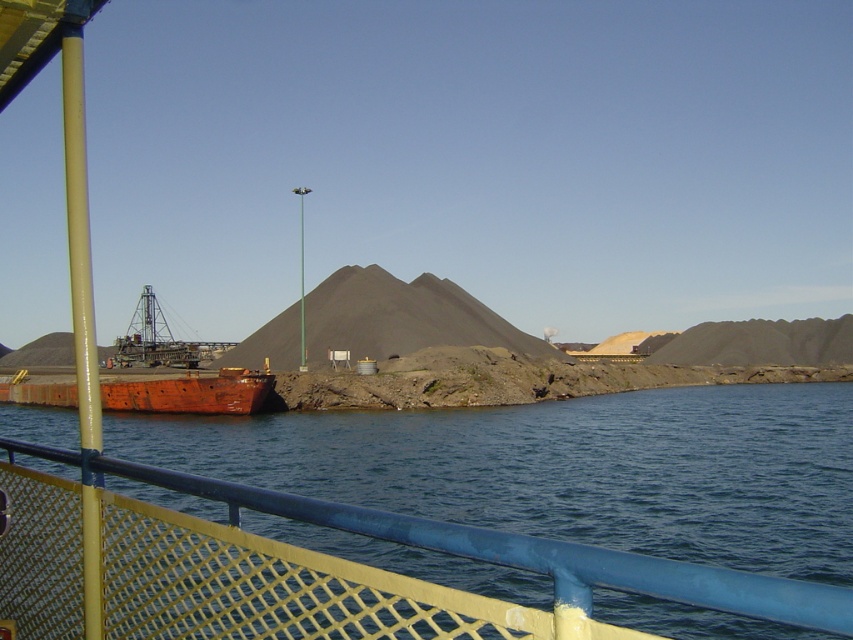
Does blue water at lower center appear on the left side of rusty metal boat at lower left?

Incorrect, blue water at lower center is not on the left side of rusty metal boat at lower left.

Does blue water at lower center have a lesser width compared to rusty metal boat at lower left?

No, blue water at lower center is not thinner than rusty metal boat at lower left.

Where is `blue water at lower center`? Image resolution: width=853 pixels, height=640 pixels. blue water at lower center is located at coordinates (566, 468).